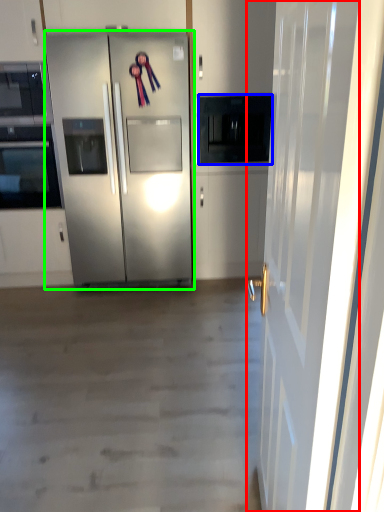
Question: Which is farther away from door (highlighted by a red box)? appliance (highlighted by a blue box) or refrigerator (highlighted by a green box)?

Choices:
 (A) appliance
 (B) refrigerator

Answer: (A)